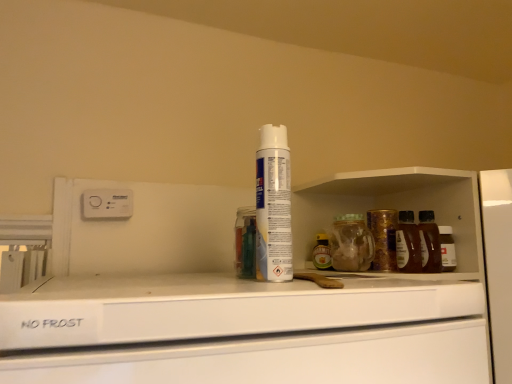
Question: Should I look upward or downward to see white plastic electric outlet at upper left?

Choices:
 (A) up
 (B) down

Answer: (B)

Question: Is white matte shaving cream at center positioned with its back to white plastic electric outlet at upper left?

Choices:
 (A) no
 (B) yes

Answer: (A)

Question: From the image's perspective, is white matte shaving cream at center over white plastic electric outlet at upper left?

Choices:
 (A) no
 (B) yes

Answer: (B)

Question: From a real-world perspective, is white matte shaving cream at center beneath white plastic electric outlet at upper left?

Choices:
 (A) yes
 (B) no

Answer: (A)

Question: Can you confirm if white matte shaving cream at center is smaller than white plastic electric outlet at upper left?

Choices:
 (A) no
 (B) yes

Answer: (A)

Question: From the image's perspective, is white matte shaving cream at center located beneath white plastic electric outlet at upper left?

Choices:
 (A) no
 (B) yes

Answer: (A)

Question: Does white matte shaving cream at center come behind white plastic electric outlet at upper left?

Choices:
 (A) no
 (B) yes

Answer: (A)

Question: Is white plastic electric outlet at upper left positioned with its back to white matte shaving cream at center?

Choices:
 (A) no
 (B) yes

Answer: (A)

Question: Is white plastic electric outlet at upper left positioned beyond the bounds of white matte shaving cream at center?

Choices:
 (A) yes
 (B) no

Answer: (A)

Question: Does white plastic electric outlet at upper left have a lesser height compared to white matte shaving cream at center?

Choices:
 (A) yes
 (B) no

Answer: (A)

Question: Does white plastic electric outlet at upper left have a smaller size compared to white matte shaving cream at center?

Choices:
 (A) no
 (B) yes

Answer: (B)

Question: Can you confirm if white plastic electric outlet at upper left is wider than white matte shaving cream at center?

Choices:
 (A) no
 (B) yes

Answer: (A)

Question: Considering the relative sizes of white plastic electric outlet at upper left and white matte shaving cream at center in the image provided, is white plastic electric outlet at upper left taller than white matte shaving cream at center?

Choices:
 (A) no
 (B) yes

Answer: (A)

Question: From a real-world perspective, relative to white matte shaving cream at center, is white plastic electric outlet at upper left vertically above or below?

Choices:
 (A) below
 (B) above

Answer: (B)